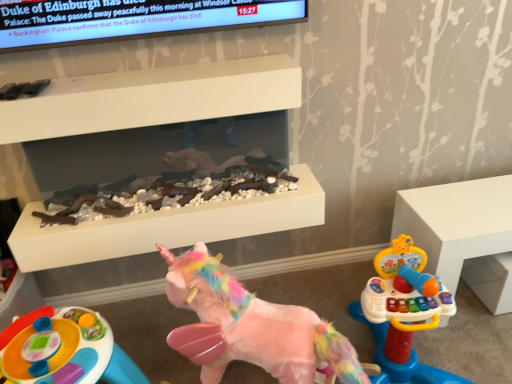
Question: Is white plastic toy at right closer to camera compared to white matte fireplace at upper center?

Choices:
 (A) no
 (B) yes

Answer: (A)

Question: From a real-world perspective, does white plastic toy at right sit lower than white matte fireplace at upper center?

Choices:
 (A) no
 (B) yes

Answer: (B)

Question: Is there a large distance between white plastic toy at right and white matte fireplace at upper center?

Choices:
 (A) no
 (B) yes

Answer: (A)

Question: From the image's perspective, is white plastic toy at right under white matte fireplace at upper center?

Choices:
 (A) yes
 (B) no

Answer: (A)

Question: Is white plastic toy at right to the left of white matte fireplace at upper center from the viewer's perspective?

Choices:
 (A) yes
 (B) no

Answer: (B)

Question: Is point (167, 279) positioned closer to the camera than point (223, 233)?

Choices:
 (A) farther
 (B) closer

Answer: (B)

Question: In terms of size, does fluffy pink unicorn at center, which is the 1th toy from right to left, appear bigger or smaller than white matte fireplace at upper center?

Choices:
 (A) small
 (B) big

Answer: (B)

Question: From a real-world perspective, is fluffy pink unicorn at center, which is the 1th toy from right to left, physically located above or below white matte fireplace at upper center?

Choices:
 (A) above
 (B) below

Answer: (B)

Question: Visually, is fluffy pink unicorn at center, positioned as the 2th toy in left-to-right order, positioned to the left or to the right of white matte fireplace at upper center?

Choices:
 (A) left
 (B) right

Answer: (B)

Question: Which is correct: fluffy pink unicorn at center, which is the 1th toy from right to left, is inside white plastic toy at right, or outside of it?

Choices:
 (A) inside
 (B) outside

Answer: (B)

Question: Considering the positions of point (346, 357) and point (476, 233), is point (346, 357) closer or farther from the camera than point (476, 233)?

Choices:
 (A) farther
 (B) closer

Answer: (B)

Question: From the image's perspective, relative to white plastic toy at right, is fluffy pink unicorn at center, which is the 1th toy from right to left, above or below?

Choices:
 (A) below
 (B) above

Answer: (A)

Question: In the image, is fluffy pink unicorn at center, which is the 1th toy from right to left, on the left side or the right side of white plastic toy at right?

Choices:
 (A) right
 (B) left

Answer: (B)

Question: From the image's perspective, is plastic colorful activity table at lower left, the 2th toy when ordered from right to left, located above or below white matte fireplace at upper center?

Choices:
 (A) below
 (B) above

Answer: (A)

Question: In terms of height, does plastic colorful activity table at lower left, the 2th toy when ordered from right to left, look taller or shorter compared to white matte fireplace at upper center?

Choices:
 (A) short
 (B) tall

Answer: (B)